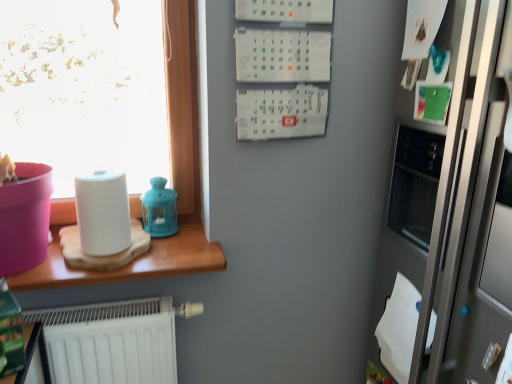
Question: Is matte blue lantern at upper center thinner than white matte paper towel at left?

Choices:
 (A) yes
 (B) no

Answer: (A)

Question: Is matte blue lantern at upper center bigger than white matte paper towel at left?

Choices:
 (A) no
 (B) yes

Answer: (A)

Question: From a real-world perspective, is matte blue lantern at upper center under white matte paper towel at left?

Choices:
 (A) yes
 (B) no

Answer: (A)

Question: Is matte blue lantern at upper center taller than white matte paper towel at left?

Choices:
 (A) yes
 (B) no

Answer: (A)

Question: From a real-world perspective, is matte blue lantern at upper center physically above white matte paper towel at left?

Choices:
 (A) yes
 (B) no

Answer: (B)

Question: Is matte blue lantern at upper center in contact with white matte paper towel at left?

Choices:
 (A) no
 (B) yes

Answer: (A)

Question: From the image's perspective, is satin silver fridge at right below white matte paper towel at left?

Choices:
 (A) no
 (B) yes

Answer: (B)

Question: Is satin silver fridge at right far away from white matte paper towel at left?

Choices:
 (A) yes
 (B) no

Answer: (B)

Question: Considering the relative positions of satin silver fridge at right and white matte paper towel at left in the image provided, is satin silver fridge at right in front of white matte paper towel at left?

Choices:
 (A) no
 (B) yes

Answer: (B)

Question: Is satin silver fridge at right at the right side of white matte paper towel at left?

Choices:
 (A) yes
 (B) no

Answer: (A)

Question: Is satin silver fridge at right located outside white matte paper towel at left?

Choices:
 (A) yes
 (B) no

Answer: (A)

Question: Considering the relative sizes of satin silver fridge at right and white matte paper towel at left in the image provided, is satin silver fridge at right shorter than white matte paper towel at left?

Choices:
 (A) yes
 (B) no

Answer: (B)

Question: Considering the relative sizes of wooden table at left and satin silver fridge at right in the image provided, is wooden table at left thinner than satin silver fridge at right?

Choices:
 (A) no
 (B) yes

Answer: (B)